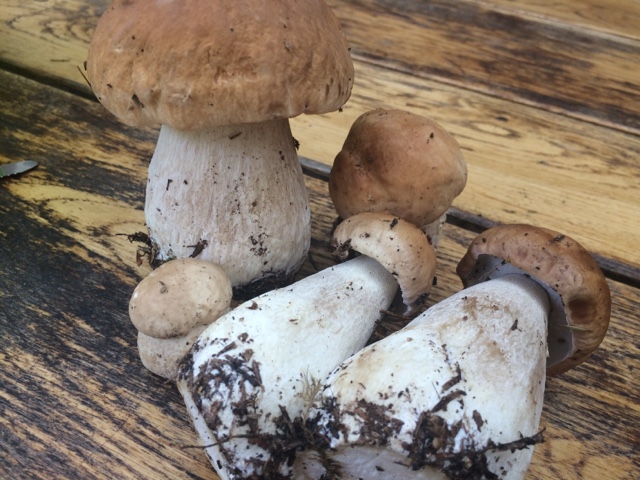
Locate an element on the screen. The image size is (640, 480). brown wood table is located at coordinates (557, 160).